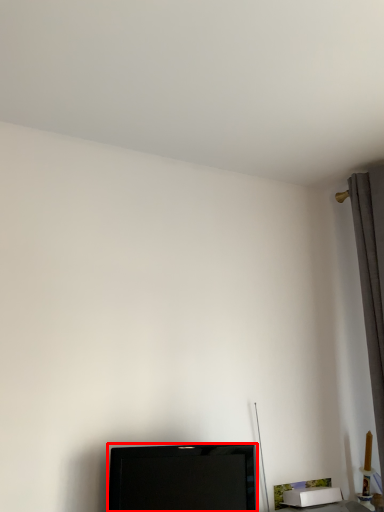
Question: From the image's perspective, what is the correct spatial relationship of television (annotated by the red box) in relation to curtain?

Choices:
 (A) above
 (B) below

Answer: (B)